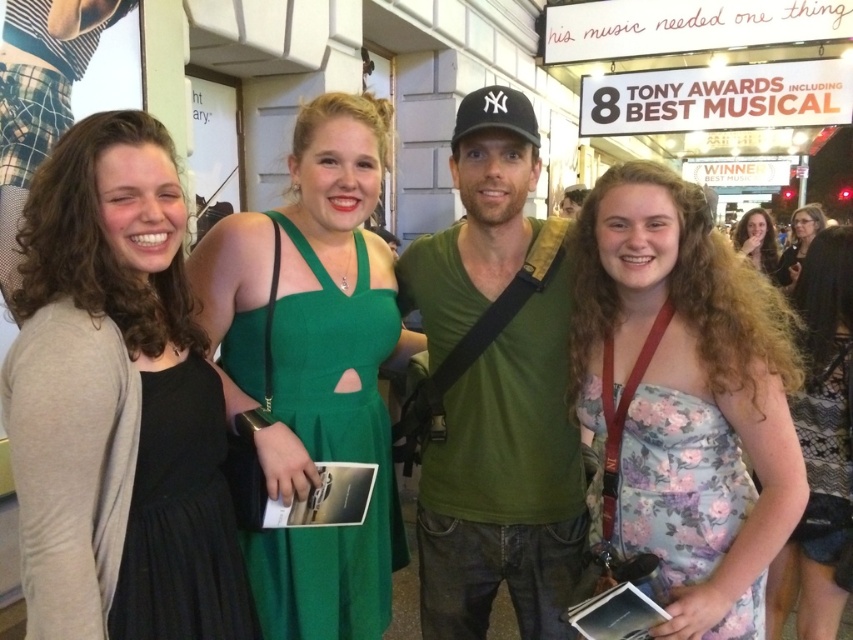
You are a photographer at the event and need to capture a photo of both the floral print dress at center and the matte black dress at left. Which dress is closer to the camera?

The floral print dress at center is closer to the camera than the matte black dress at left.

You are a photographer at the event and need to fit both the green satin dress at center and the matte green dress at center into a single frame. Which dress is narrower and would allow for better framing?

The green satin dress at center is thinner than the matte green dress at center, so it is narrower and would allow for better framing.